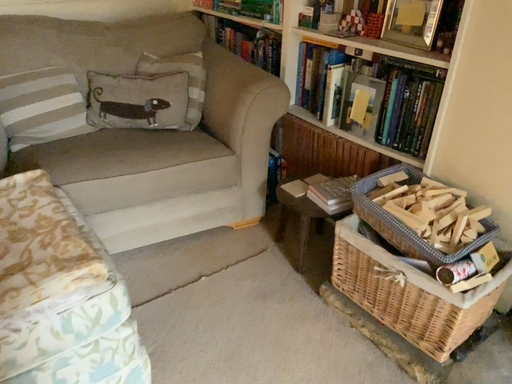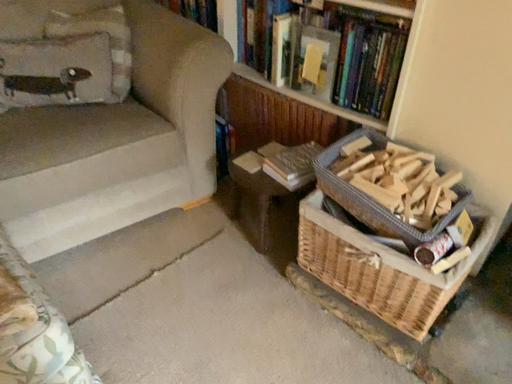
Question: How did the camera likely rotate when shooting the video?

Choices:
 (A) rotated upward
 (B) rotated downward

Answer: (B)